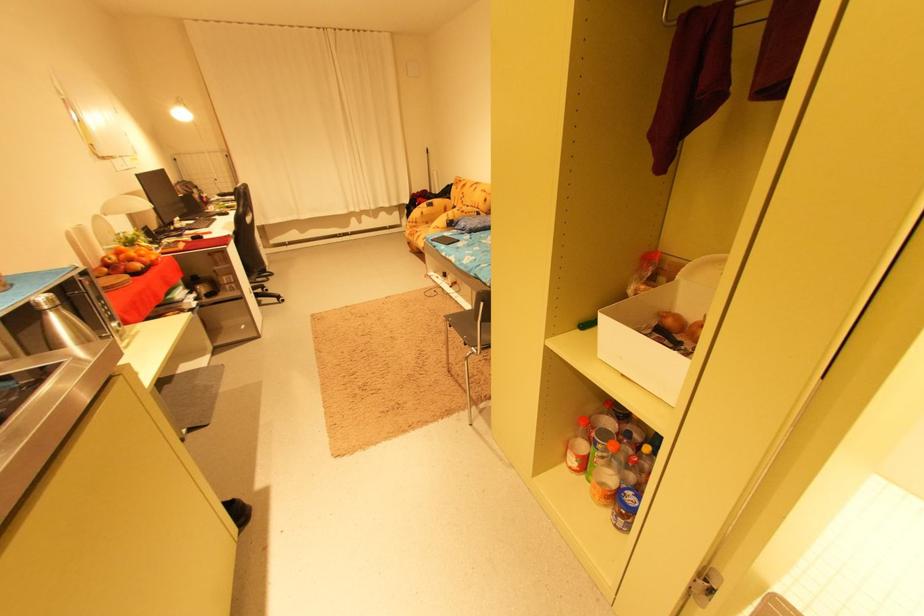
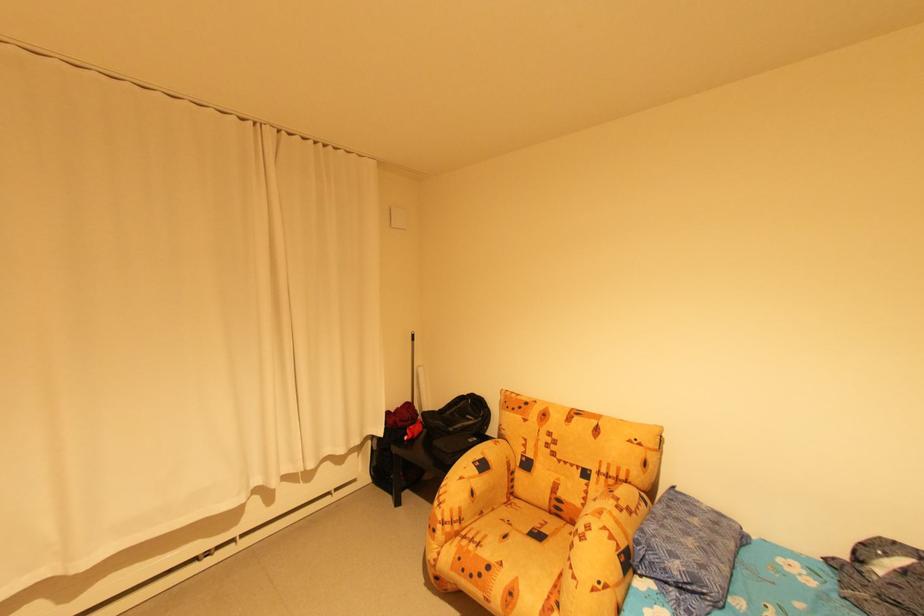
The point at (419, 225) is marked in the first image. Where is the corresponding point in the second image?

(456, 529)